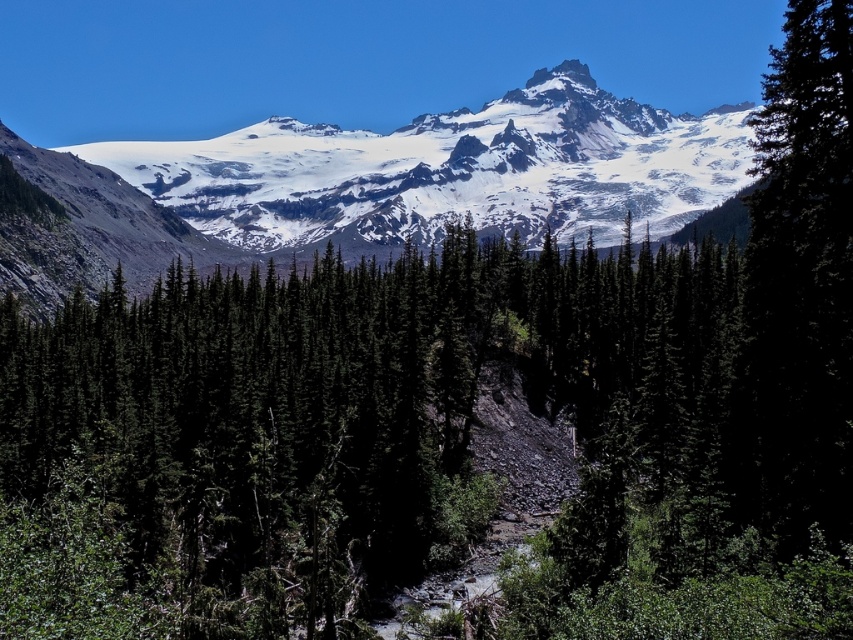
Between point (233, 548) and point (804, 332), which one is positioned in front?

Positioned in front is point (804, 332).

Is point (45, 422) positioned behind point (845, 468)?

Yes, point (45, 422) is farther from viewer.

This screenshot has height=640, width=853. What are the coordinates of `green matte tree at center` in the screenshot? It's located at (350, 410).

Which is behind, point (846, 122) or point (578, 67)?

The point (578, 67) is behind.

Is green matte tree at right in front of white rocky peak at upper center?

Yes, it is.

Between point (839, 259) and point (555, 74), which one is positioned in front?

Point (839, 259) is in front.

Locate an element on the screen. green matte tree at right is located at coordinates (798, 289).

Does snowy granite mountain range at upper center have a lesser height compared to green matte tree at right?

Correct, snowy granite mountain range at upper center is not as tall as green matte tree at right.

Who is taller, snowy granite mountain range at upper center or green matte tree at right?

With more height is green matte tree at right.

Describe the element at coordinates (370, 186) in the screenshot. I see `snowy granite mountain range at upper center` at that location.

The width and height of the screenshot is (853, 640). I want to click on snowy granite mountain range at upper center, so click(x=370, y=186).